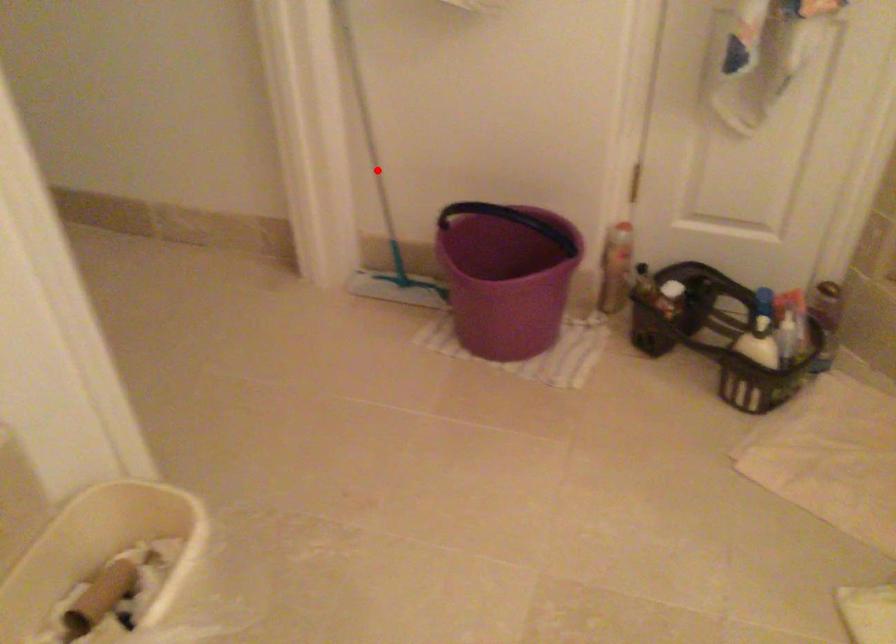
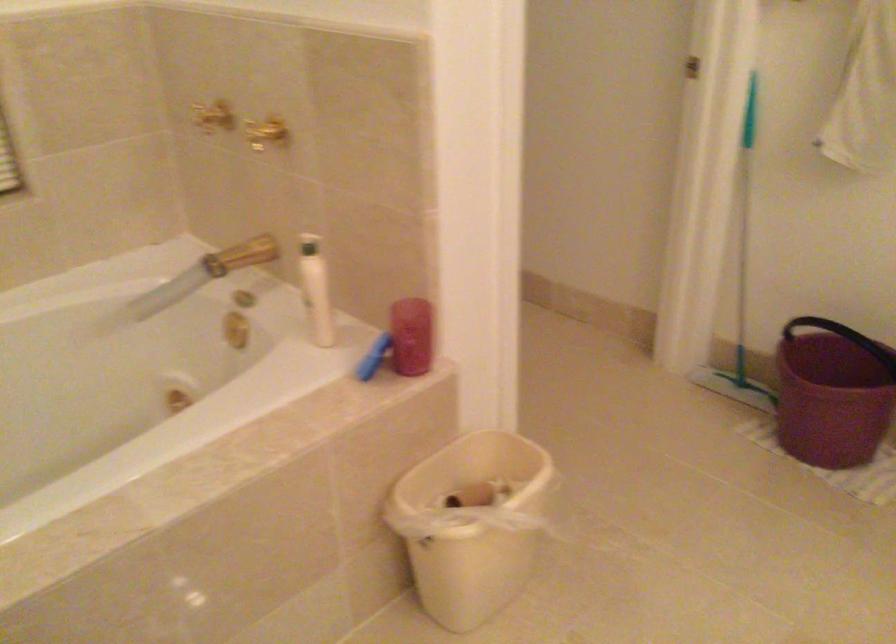
Locate, in the second image, the point that corresponds to the highlighted location in the first image.

(742, 279)